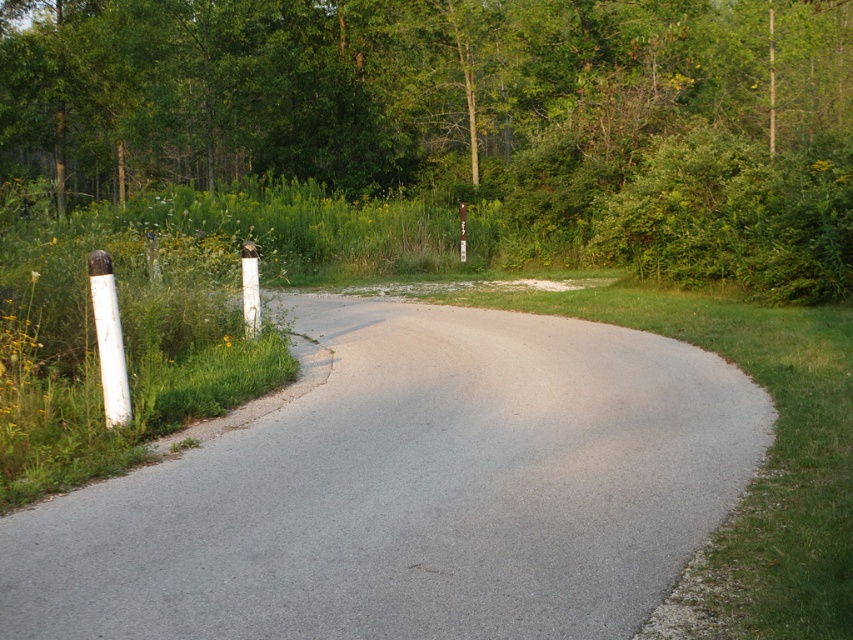
Based on the scene described, which object is wider when comparing the green leafy tree at upper center and the gray asphalt road at center?

The green leafy tree at upper center is wider than the gray asphalt road at center according to the description.

You are a surveyor measuring the height of objects in the scene. Which object is shorter between the gray asphalt road at center and the white painted wood post at left?

The gray asphalt road at center is not as tall as the white painted wood post at left, so the road is shorter.